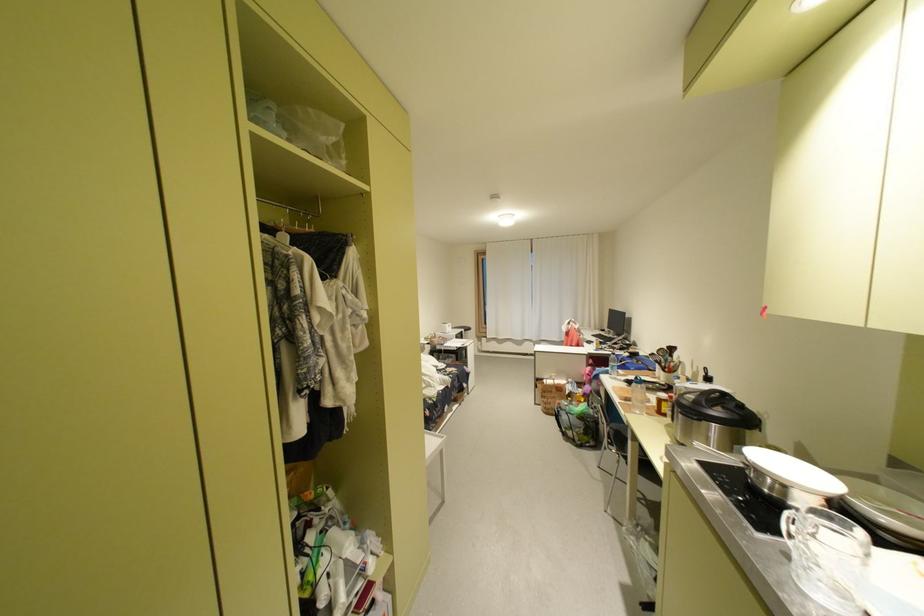
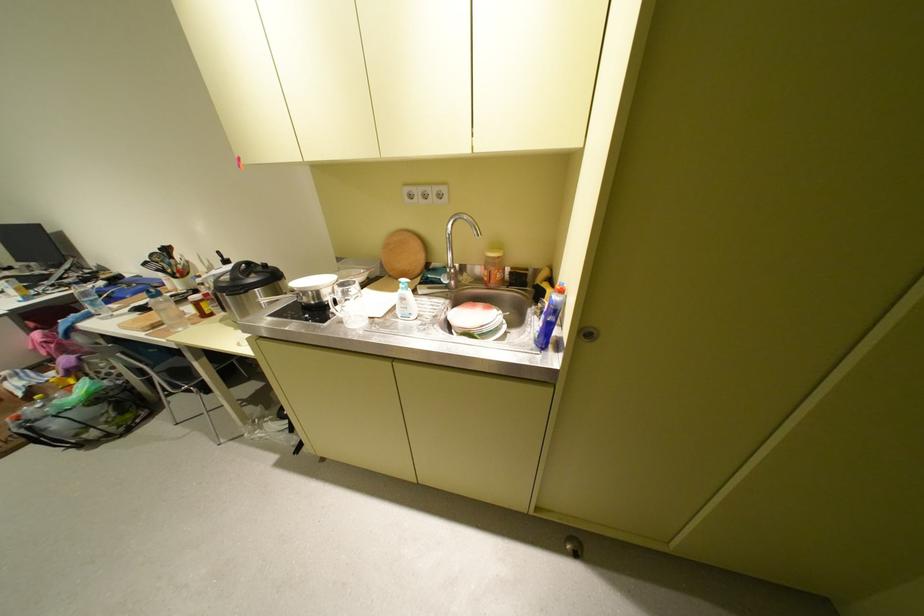
The images are taken continuously from a first-person perspective. In which direction is your viewpoint rotating?

The camera's rotation is toward right-down.